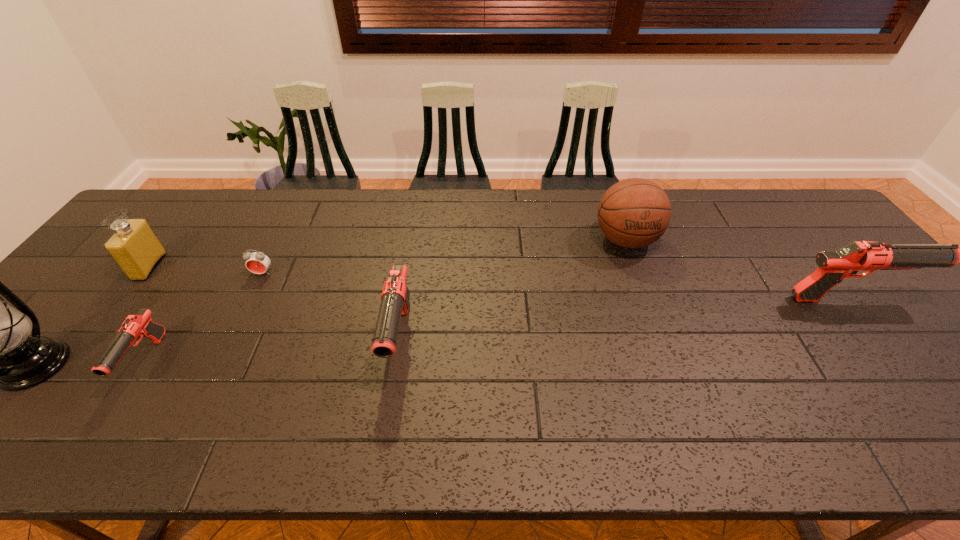
Locate an element on the screen. This screenshot has width=960, height=540. vacant space that's between the perfume and the shortest object is located at coordinates (206, 270).

I want to click on free space between the fourth object from left to right and the fifth object from right to left, so click(204, 317).

What are the coordinates of `free space between the rightmost gun and the third object from right to left` in the screenshot? It's located at coord(624,319).

You are a GUI agent. You are given a task and a screenshot of the screen. Output one action in this format:
    pyautogui.click(x=<x>, y=<y>)
    Task: Click on the free space between the rightmost gun and the second tallest gun
    
    Given the screenshot: What is the action you would take?
    pyautogui.click(x=624, y=319)

This screenshot has width=960, height=540. What are the coordinates of `free space between the rightmost gun and the perfume` in the screenshot? It's located at (499, 283).

Find the location of `free area in between the rightmost gun and the shortest gun`. free area in between the rightmost gun and the shortest gun is located at coordinates (497, 330).

At what (x,y) coordinates should I click in order to perform the action: click on the closest object to the oil lamp. Please return your answer as a coordinate pair (x, y). This screenshot has width=960, height=540. Looking at the image, I should click on (137, 326).

Choose which object is the third nearest neighbor to the perfume. Please provide its 2D coordinates. Your answer should be formatted as a tuple, i.e. [(x, y)], where the tuple contains the x and y coordinates of a point satisfying the conditions above.

[(257, 262)]

Identify which gun is the third nearest to the perfume. Please provide its 2D coordinates. Your answer should be formatted as a tuple, i.e. [(x, y)], where the tuple contains the x and y coordinates of a point satisfying the conditions above.

[(833, 266)]

Where is `gun that is the second closest one to the second shortest object`? This screenshot has width=960, height=540. gun that is the second closest one to the second shortest object is located at coordinates (833, 266).